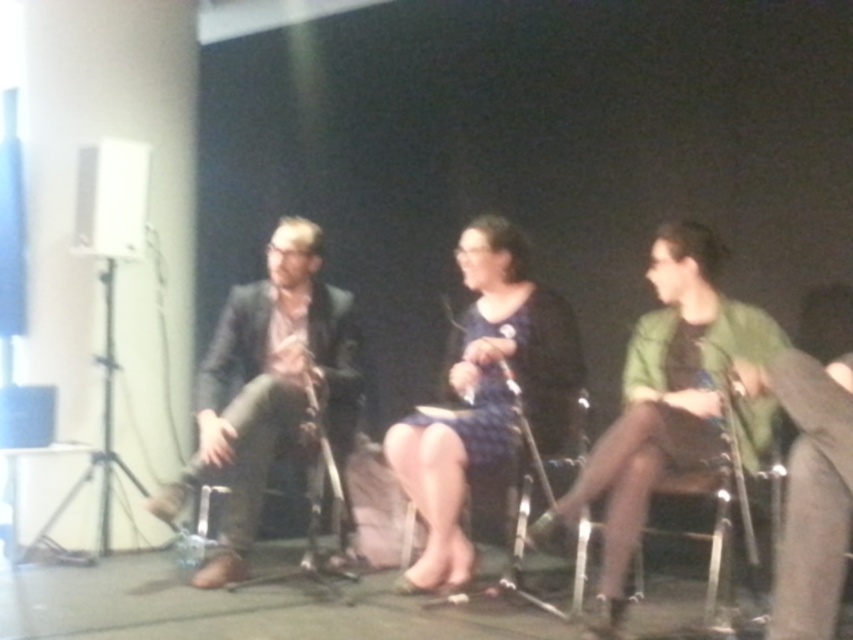
Which is more to the right, dark brown leather jacket at left or wooden chair at center?

Result: Positioned to the right is wooden chair at center.

In the scene shown: Is dark brown leather jacket at left in front of wooden chair at center?

No, it is behind wooden chair at center.

Is point (253, 404) positioned behind point (576, 545)?

No, (253, 404) is closer to viewer.

You are a GUI agent. You are given a task and a screenshot of the screen. Output one action in this format:
    pyautogui.click(x=<x>, y=<y>)
    Task: Click on the dark brown leather jacket at left
    
    Given the screenshot: What is the action you would take?
    pyautogui.click(x=267, y=385)

Is point (405, 492) closer to viewer compared to point (577, 608)?

No, it is behind (577, 608).

The height and width of the screenshot is (640, 853). What do you see at coordinates (479, 394) in the screenshot?
I see `blue textured dress at center` at bounding box center [479, 394].

Measure the distance between point (473, 228) and camera.

Point (473, 228) is 3.66 meters away from camera.

You are a GUI agent. You are given a task and a screenshot of the screen. Output one action in this format:
    pyautogui.click(x=<x>, y=<y>)
    Task: Click on the blue textured dress at center
    The width and height of the screenshot is (853, 640).
    Given the screenshot: What is the action you would take?
    pyautogui.click(x=479, y=394)

Can you confirm if green matte jacket at center is wider than blue textured dress at center?

Indeed, green matte jacket at center has a greater width compared to blue textured dress at center.

Does green matte jacket at center appear on the right side of blue textured dress at center?

Yes, green matte jacket at center is to the right of blue textured dress at center.

At what (x,y) coordinates should I click in order to perform the action: click on green matte jacket at center. Please return your answer as a coordinate pair (x, y). This screenshot has width=853, height=640. Looking at the image, I should click on (662, 397).